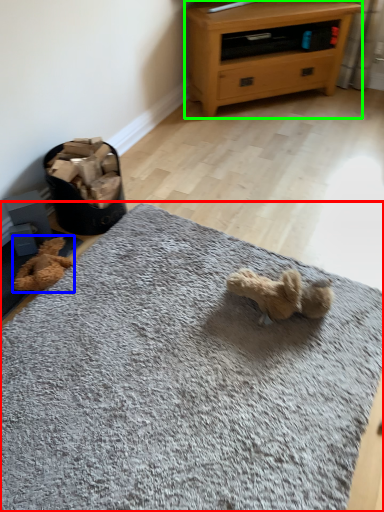
Question: Based on their relative distances, which object is nearer to mat (highlighted by a red box)? Choose from teddy (highlighted by a blue box) and chest of drawers (highlighted by a green box).

Choices:
 (A) teddy
 (B) chest of drawers

Answer: (A)